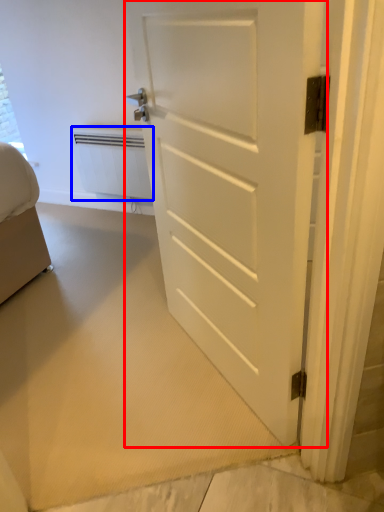
Question: Among these objects, which one is farthest to the camera, door (highlighted by a red box) or radiator (highlighted by a blue box)?

Choices:
 (A) door
 (B) radiator

Answer: (B)